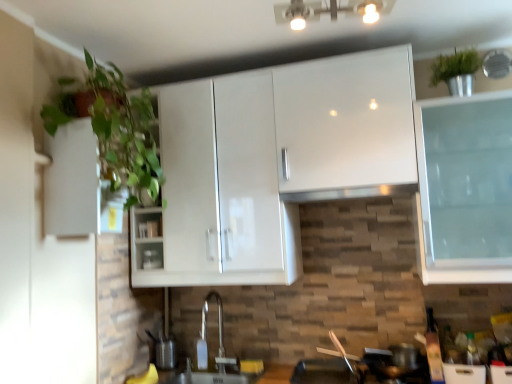
Question: Considering the positions of matte silver sink at lower center, arranged as the 2th sink when viewed from the top, and metallic silver toaster at center in the image, is matte silver sink at lower center, arranged as the 2th sink when viewed from the top, taller or shorter than metallic silver toaster at center?

Choices:
 (A) short
 (B) tall

Answer: (B)

Question: From a real-world perspective, relative to metallic silver toaster at center, is matte silver sink at lower center, which ranks as the first sink in bottom-to-top order, vertically above or below?

Choices:
 (A) above
 (B) below

Answer: (B)

Question: Which object is the closest to the satin nickel faucet at center, which is the first sink in top-to-bottom order?

Choices:
 (A) matte silver sink at lower center, which ranks as the first sink in bottom-to-top order
 (B) green leafy plant at left
 (C) satin silver exhaust hood at center
 (D) white glossy light fixture at upper center
 (E) metallic silver toaster at center

Answer: (A)

Question: Based on their relative distances, which object is nearer to the metallic silver toaster at center?

Choices:
 (A) matte silver sink at lower center, arranged as the 2th sink when viewed from the top
 (B) white glossy cabinet at left
 (C) green leafy plant at left
 (D) white glossy light fixture at upper center
 (E) satin silver exhaust hood at center

Answer: (A)